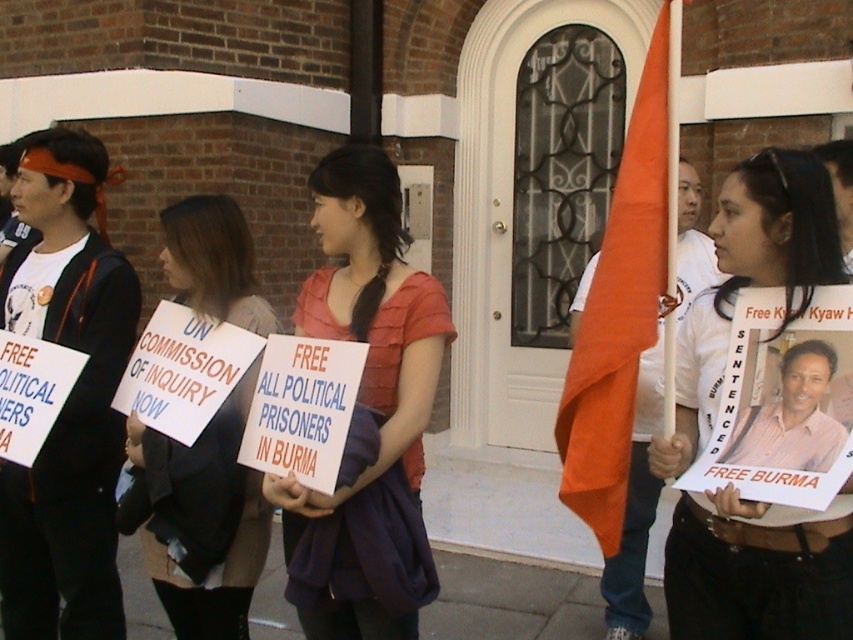
Question: Which object is farther from the camera taking this photo?

Choices:
 (A) black fabric sign at center
 (B) matte white shirt at center

Answer: (A)

Question: Which point appears closest to the camera in this image?

Choices:
 (A) (746, 589)
 (B) (236, 593)

Answer: (A)

Question: Which object is farther from the camera taking this photo?

Choices:
 (A) matte pink blouse at center
 (B) matte white shirt at center
 (C) black fabric sign at center

Answer: (C)

Question: Can you confirm if matte white shirt at center is wider than black fabric sign at center?

Choices:
 (A) no
 (B) yes

Answer: (B)

Question: Where is matte white shirt at center located in relation to matte pink blouse at center in the image?

Choices:
 (A) above
 (B) below

Answer: (A)

Question: Is matte white shirt at center smaller than matte pink blouse at center?

Choices:
 (A) yes
 (B) no

Answer: (A)